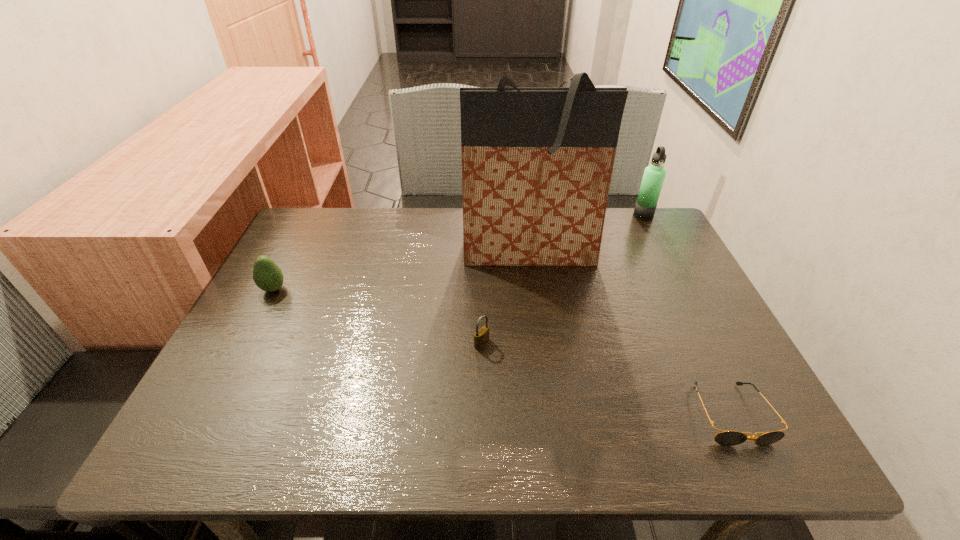
Locate an element on the screen. Image resolution: width=960 pixels, height=540 pixels. free space located 0.190m on the front-facing side of the tallest object is located at coordinates (540, 329).

This screenshot has width=960, height=540. I want to click on vacant area situated on the front of the farthest object, so click(684, 294).

Find the location of a particular element. The width and height of the screenshot is (960, 540). free region located on the front of the avocado is located at coordinates (241, 351).

This screenshot has width=960, height=540. Find the location of `blank area located 0.050m on the back of the padlock`. blank area located 0.050m on the back of the padlock is located at coordinates (482, 321).

This screenshot has height=540, width=960. In order to click on shopping bag that is at the far edge in this screenshot , I will do `click(537, 163)`.

You are a GUI agent. You are given a task and a screenshot of the screen. Output one action in this format:
    pyautogui.click(x=<x>, y=<y>)
    Task: Click on the thermos bottle situated at the far edge
    
    Given the screenshot: What is the action you would take?
    pyautogui.click(x=654, y=175)

Find the location of `object that is at the near edge`. object that is at the near edge is located at coordinates (728, 438).

Find the location of a particular element. object present at the left edge is located at coordinates (267, 275).

You are a GUI agent. You are given a task and a screenshot of the screen. Output one action in this format:
    pyautogui.click(x=<x>, y=<y>)
    Task: Click on the thermos bottle that is at the right edge
    The width and height of the screenshot is (960, 540).
    Given the screenshot: What is the action you would take?
    pyautogui.click(x=654, y=175)

Locate an element on the screen. The height and width of the screenshot is (540, 960). sunglasses present at the right edge is located at coordinates (728, 438).